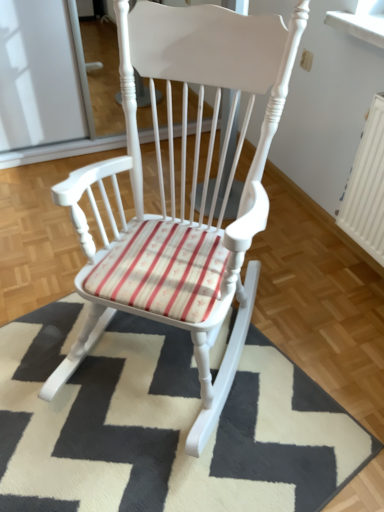
Question: Would you say white textured mat at center is to the left or to the right of white wood rocking chair at center in the picture?

Choices:
 (A) right
 (B) left

Answer: (B)

Question: From the image's perspective, is white textured mat at center located above or below white wood rocking chair at center?

Choices:
 (A) above
 (B) below

Answer: (B)

Question: Choose the correct answer: Is white textured mat at center inside white wood rocking chair at center or outside it?

Choices:
 (A) outside
 (B) inside

Answer: (A)

Question: Do you think white wood rocking chair at center is within white textured mat at center, or outside of it?

Choices:
 (A) outside
 (B) inside

Answer: (A)

Question: In terms of height, does white wood rocking chair at center look taller or shorter compared to white textured mat at center?

Choices:
 (A) tall
 (B) short

Answer: (A)

Question: Looking at their shapes, would you say white wood rocking chair at center is wider or thinner than white textured mat at center?

Choices:
 (A) wide
 (B) thin

Answer: (B)

Question: Is white wood rocking chair at center bigger or smaller than white textured mat at center?

Choices:
 (A) big
 (B) small

Answer: (A)